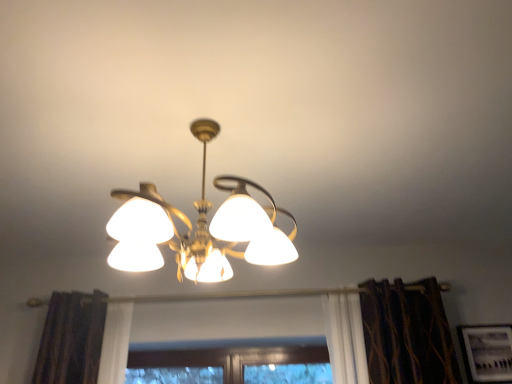
Question: Should I look upward or downward to see gold metallic chandelier at center?

Choices:
 (A) up
 (B) down

Answer: (B)

Question: Considering the relative sizes of gold metallic chandelier at center and matte white picture frame at lower right in the image provided, is gold metallic chandelier at center thinner than matte white picture frame at lower right?

Choices:
 (A) no
 (B) yes

Answer: (A)

Question: Does gold metallic chandelier at center have a smaller size compared to matte white picture frame at lower right?

Choices:
 (A) no
 (B) yes

Answer: (A)

Question: Is matte white picture frame at lower right surrounded by gold metallic chandelier at center?

Choices:
 (A) yes
 (B) no

Answer: (B)

Question: From a real-world perspective, is gold metallic chandelier at center on matte white picture frame at lower right?

Choices:
 (A) yes
 (B) no

Answer: (A)

Question: Considering the relative positions of gold metallic chandelier at center and matte white picture frame at lower right in the image provided, is gold metallic chandelier at center to the left of matte white picture frame at lower right from the viewer's perspective?

Choices:
 (A) no
 (B) yes

Answer: (B)

Question: Is gold metallic chandelier at center directly adjacent to matte white picture frame at lower right?

Choices:
 (A) yes
 (B) no

Answer: (B)

Question: Is matte white picture frame at lower right facing away from gold metallic chandelier at center?

Choices:
 (A) yes
 (B) no

Answer: (B)

Question: From the image's perspective, is matte white picture frame at lower right located above gold metallic chandelier at center?

Choices:
 (A) yes
 (B) no

Answer: (B)

Question: Considering the relative positions of matte white picture frame at lower right and gold metallic chandelier at center in the image provided, is matte white picture frame at lower right to the left of gold metallic chandelier at center from the viewer's perspective?

Choices:
 (A) yes
 (B) no

Answer: (B)

Question: Does matte white picture frame at lower right have a greater width compared to gold metallic chandelier at center?

Choices:
 (A) no
 (B) yes

Answer: (A)

Question: Is matte white picture frame at lower right bigger than gold metallic chandelier at center?

Choices:
 (A) no
 (B) yes

Answer: (A)

Question: Is the depth of matte white picture frame at lower right less than that of gold metallic chandelier at center?

Choices:
 (A) yes
 (B) no

Answer: (B)

Question: From a real-world perspective, relative to gold metallic chandelier at center, is matte white picture frame at lower right vertically above or below?

Choices:
 (A) above
 (B) below

Answer: (B)